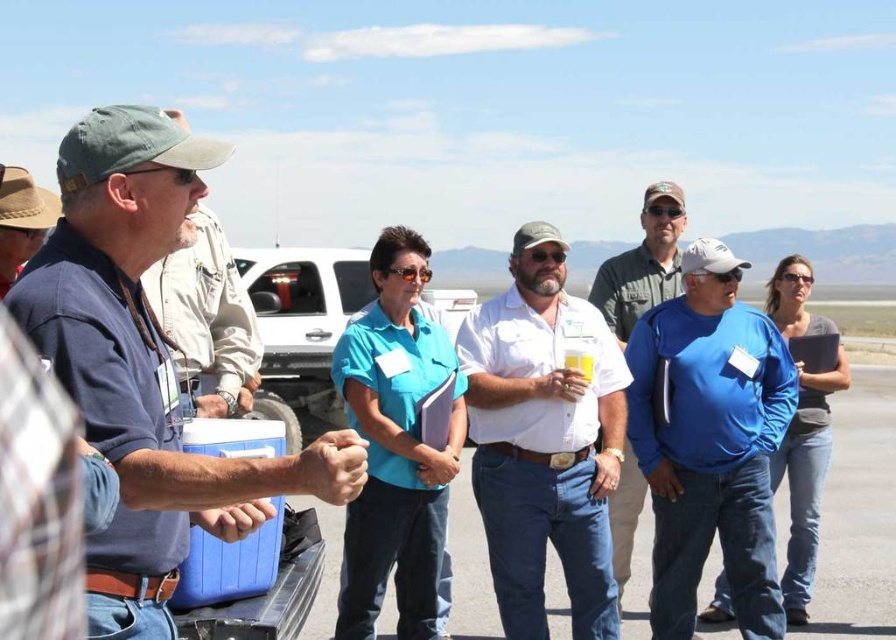
You are standing at the point with coordinates point (x=604, y=300) and want to walk towards the group of people near point (x=242, y=461). Which direction should you go?

You should walk towards the point (x=242, y=461), which is in front of point (x=604, y=300), so you should move forward in the direction facing away from the distant mountains.

You are standing at the center of the paved area and see a point marked at coordinates (643, 262). What object is located at that point?

The point at (643, 262) corresponds to the green matte shirt at center.

You are standing in the open area and want to walk from point (683,636) to point (398,502). Since you can only move forward, will you need to walk towards or away from the distant mountains?

Point (683,636) is further to the viewer than point (398,502). Therefore, to move from point (683,636) to point (398,502), you would need to walk away from the distant mountains.